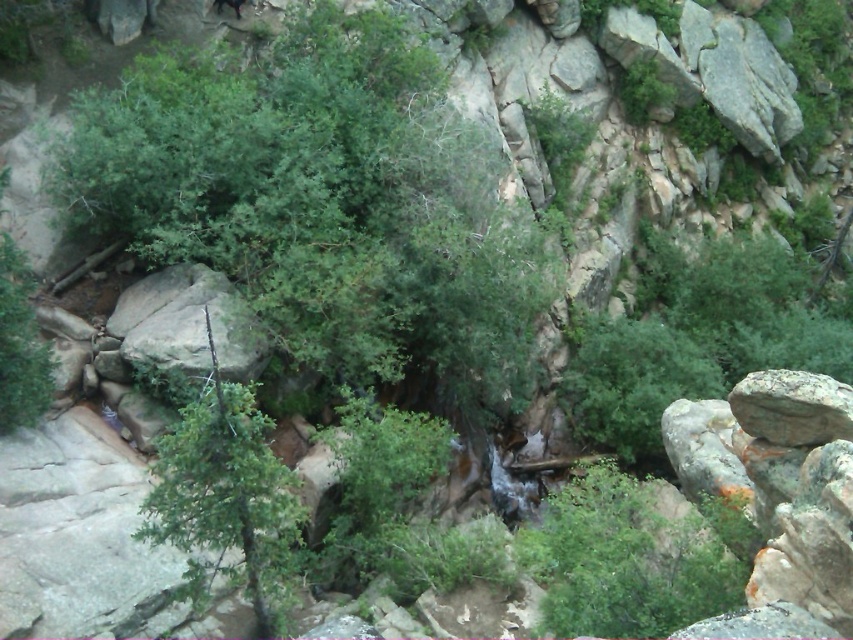
You are standing at the point with coordinates point [630,556] in the rugged, natural landscape. What do you see at that location?

At point [630,556] lies green leafy bush at center.

You are a hiker navigating through this rocky landscape and notice a green leafy shrub at center and a green textured tree at center. Which one is positioned higher up in the scene?

The green leafy shrub at center is located above the green textured tree at center, so it is positioned higher up in the scene.